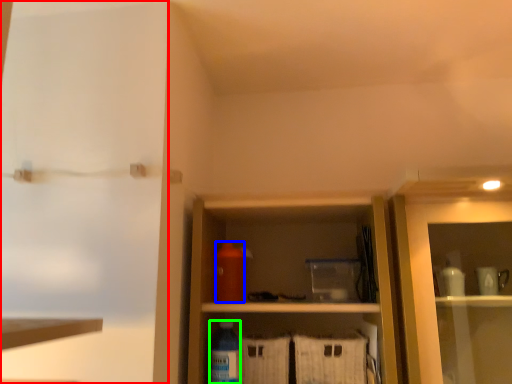
Question: Which object is positioned closest to screen door (highlighted by a red box)? Select from bottle (highlighted by a blue box) and bottle (highlighted by a green box).

Choices:
 (A) bottle
 (B) bottle

Answer: (A)